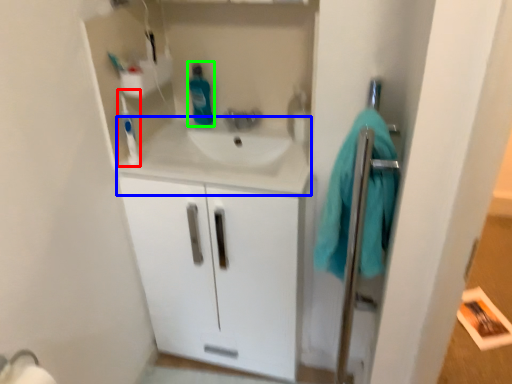
Question: Which object is the farthest from toothbrush (highlighted by a red box)? Choose among these: counter top (highlighted by a blue box) or cleaning product (highlighted by a green box).

Choices:
 (A) counter top
 (B) cleaning product

Answer: (B)